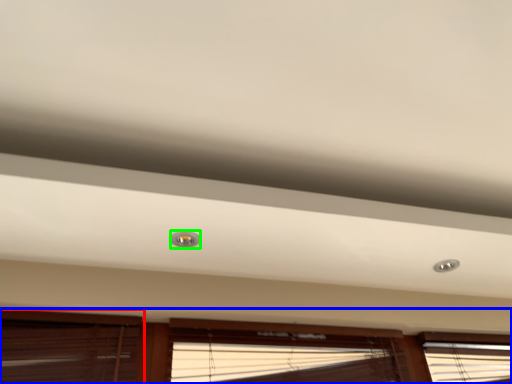
Question: Considering the real-world distances, which object is closest to window (highlighted by a red box)? window (highlighted by a blue box) or droplight (highlighted by a green box).

Choices:
 (A) window
 (B) droplight

Answer: (A)